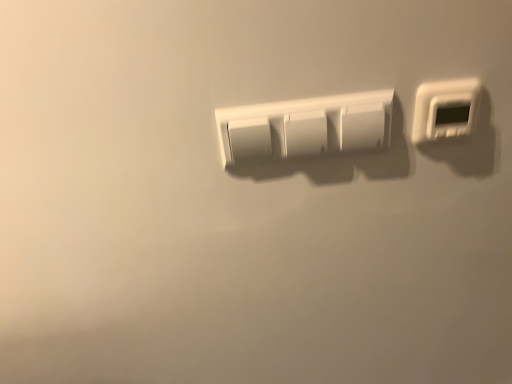
Question: From their relative heights in the image, would you say white plastic thermostat at upper right, arranged as the second light switch when viewed from the left, is taller or shorter than white matte light switch at center, the first light switch in the left-to-right sequence?

Choices:
 (A) short
 (B) tall

Answer: (A)

Question: Based on their positions, is white plastic thermostat at upper right, arranged as the second light switch when viewed from the left, located to the left or right of white matte light switch at center, the first light switch in the left-to-right sequence?

Choices:
 (A) left
 (B) right

Answer: (B)

Question: Relative to white matte light switch at center, the 2th light switch when ordered from right to left, is white plastic thermostat at upper right, positioned as the first light switch in right-to-left order, in front or behind?

Choices:
 (A) front
 (B) behind

Answer: (A)

Question: Considering the positions of white matte light switch at center, the first light switch in the left-to-right sequence, and white plastic thermostat at upper right, positioned as the first light switch in right-to-left order, in the image, is white matte light switch at center, the first light switch in the left-to-right sequence, taller or shorter than white plastic thermostat at upper right, positioned as the first light switch in right-to-left order,?

Choices:
 (A) tall
 (B) short

Answer: (A)

Question: From a real-world perspective, relative to white plastic thermostat at upper right, positioned as the first light switch in right-to-left order, is white matte light switch at center, the first light switch in the left-to-right sequence, vertically above or below?

Choices:
 (A) below
 (B) above

Answer: (A)

Question: Considering the positions of point (270, 142) and point (467, 132), is point (270, 142) closer or farther from the camera than point (467, 132)?

Choices:
 (A) farther
 (B) closer

Answer: (B)

Question: From the image's perspective, is white matte light switch at center, the 2th light switch when ordered from right to left, located above or below white plastic thermostat at upper right, positioned as the first light switch in right-to-left order?

Choices:
 (A) below
 (B) above

Answer: (A)